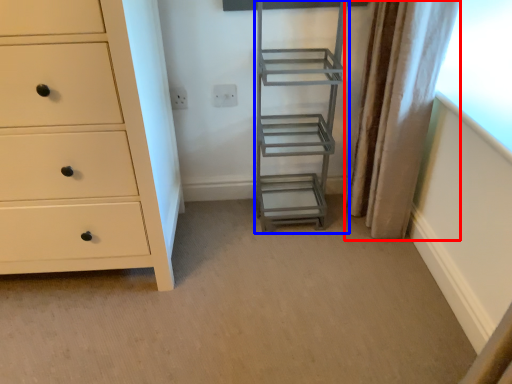
Question: Among these objects, which one is farthest to the camera, curtain (highlighted by a red box) or ladder (highlighted by a blue box)?

Choices:
 (A) curtain
 (B) ladder

Answer: (B)